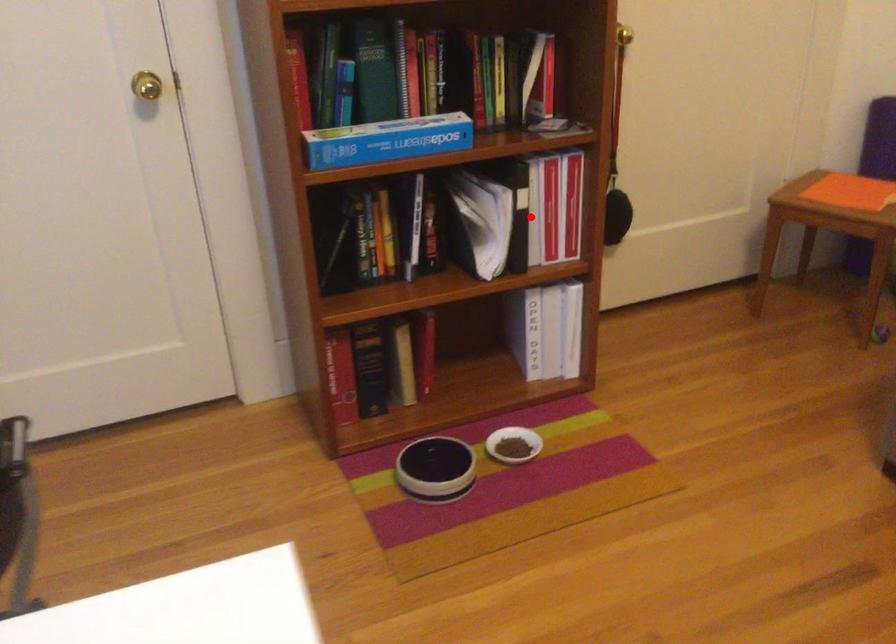
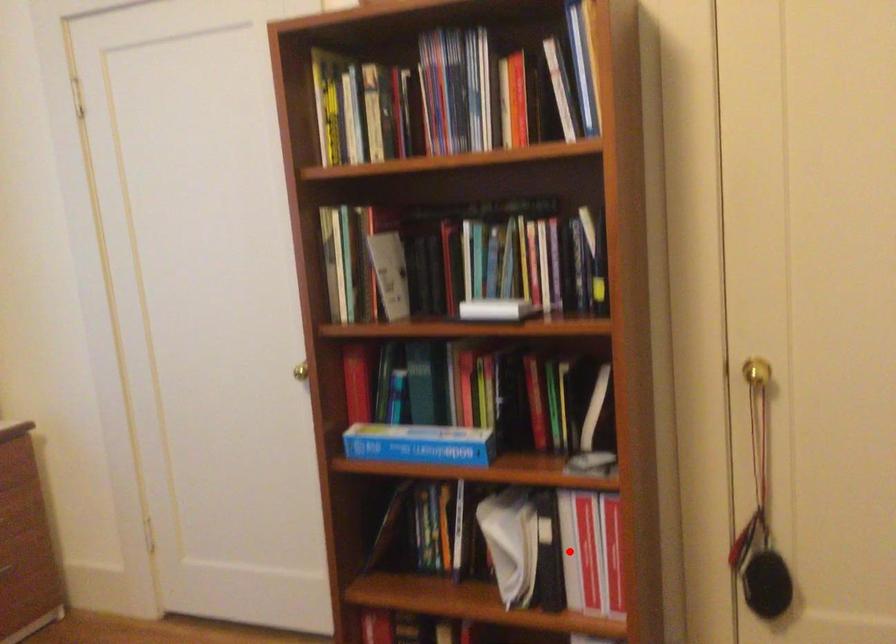
I am providing you with two images of the same scene from different viewpoints. A red point is marked on the first image and another point is marked on the second image. Is the marked point in image1 the same physical position as the marked point in image2?

Yes